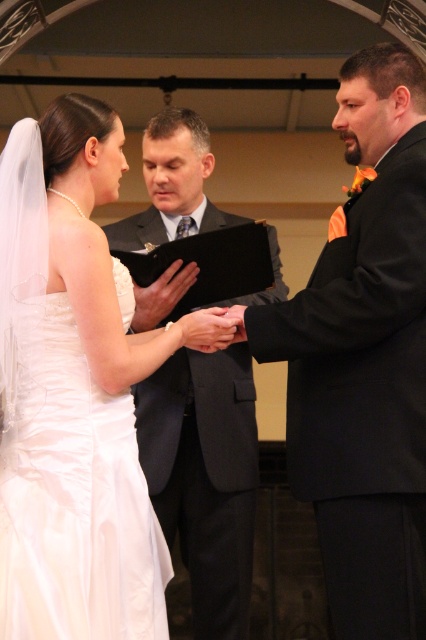
Is point (115, 564) positioned in front of point (342, 608)?

Yes.

Is point (69, 451) positioned before point (347, 500)?

Yes, point (69, 451) is in front of point (347, 500).

The image size is (426, 640). Identify the location of white satin dress at left. (71, 392).

Who is more distant from viewer, (118, 282) or (198, 157)?

The point (198, 157) is behind.

Can you confirm if white satin dress at left is positioned to the right of matte black suit at center?

Incorrect, white satin dress at left is not on the right side of matte black suit at center.

Is point (20, 556) more distant than point (161, 403)?

No, (20, 556) is closer to viewer.

Where is `white satin dress at left`? white satin dress at left is located at coordinates (71, 392).

Is black satin suit at right thinner than matte black suit at center?

Indeed, black satin suit at right has a lesser width compared to matte black suit at center.

Is black satin suit at right taller than matte black suit at center?

In fact, black satin suit at right may be shorter than matte black suit at center.

Which is behind, point (291, 305) or point (222, 483)?

The point (222, 483) is behind.

At what (x,y) coordinates should I click in order to perform the action: click on black satin suit at right. Please return your answer as a coordinate pair (x, y). Looking at the image, I should click on (363, 358).